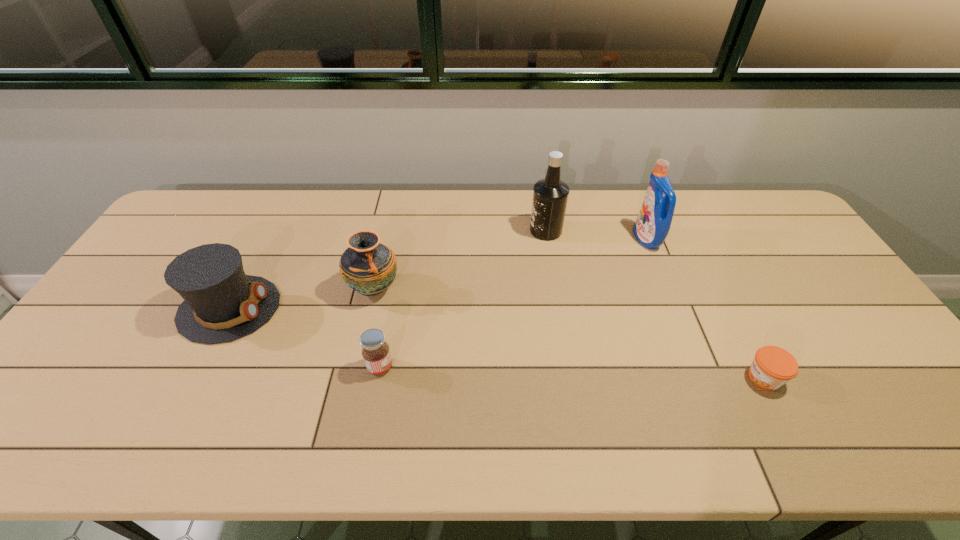
This screenshot has height=540, width=960. I want to click on free space between the taller jam and the pottery, so click(377, 328).

In order to click on unoccupied area between the pottery and the second object from right to left in this screenshot , I will do `click(511, 264)`.

This screenshot has width=960, height=540. I want to click on empty space between the detergent and the rightmost object, so click(x=706, y=308).

I want to click on vacant point located between the pottery and the fourth tallest object, so click(301, 299).

Identify the location of vacant space that is in between the shorter jam and the fourth tallest object. (496, 343).

Image resolution: width=960 pixels, height=540 pixels. Identify the location of empty space between the pottery and the taller jam. (377, 328).

Where is `blank region between the second object from right to left and the shorter jam`? The height and width of the screenshot is (540, 960). blank region between the second object from right to left and the shorter jam is located at coordinates pos(706,308).

Select which object appears as the third closest to the liquor. Please provide its 2D coordinates. Your answer should be formatted as a tuple, i.e. [(x, y)], where the tuple contains the x and y coordinates of a point satisfying the conditions above.

[(375, 351)]

Choose which object is the third nearest neighbor to the fifth object from left to right. Please provide its 2D coordinates. Your answer should be formatted as a tuple, i.e. [(x, y)], where the tuple contains the x and y coordinates of a point satisfying the conditions above.

[(368, 267)]